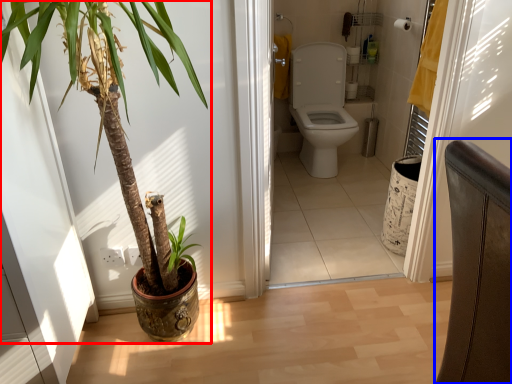
Question: Which of the following is the closest to the observer, houseplant (highlighted by a red box) or chair (highlighted by a blue box)?

Choices:
 (A) houseplant
 (B) chair

Answer: (B)